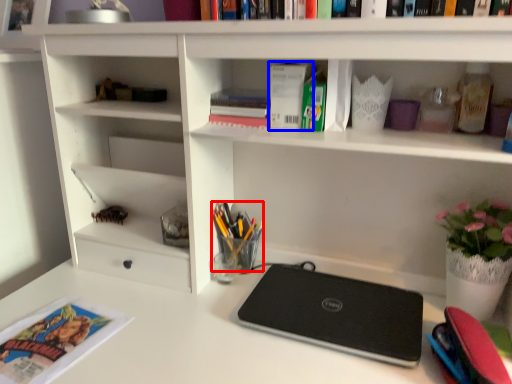
Question: Which point is further to the camera, stationery (highlighted by a red box) or paperback book (highlighted by a blue box)?

Choices:
 (A) stationery
 (B) paperback book

Answer: (A)